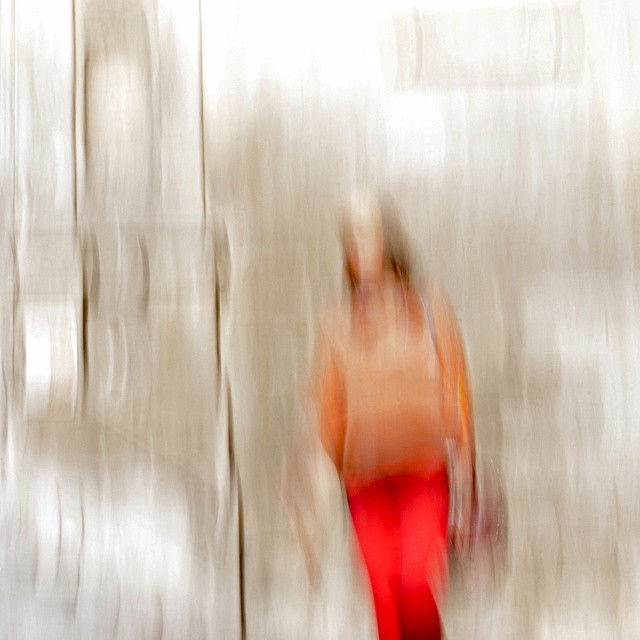
You are an interior designer reviewing this abstract image. You need to determine which object is bigger between the smooth orange fabric at center and the matte red leggings at center. Which one is larger?

The smooth orange fabric at center is larger in size than the matte red leggings at center.

You are an artist analyzing the composition of this abstract image. You notice the smooth orange fabric at center and the matte red leggings at center. Which object is closer to you in the image?

The smooth orange fabric at center is closer to you than the matte red leggings at center because it is further to the viewer.